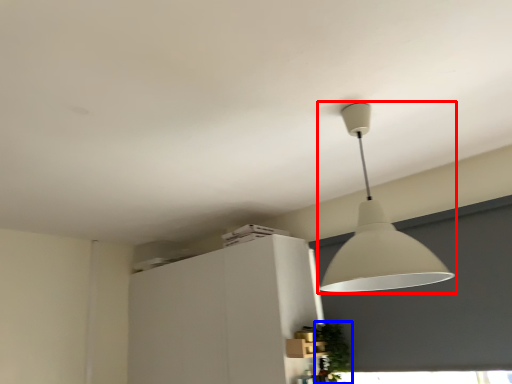
Question: Which object is further to the camera taking this photo, lamp (highlighted by a red box) or plant (highlighted by a blue box)?

Choices:
 (A) lamp
 (B) plant

Answer: (B)